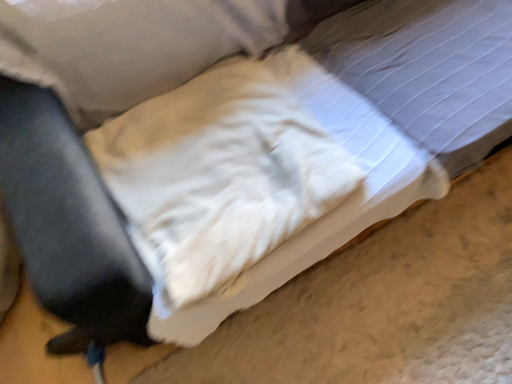
Image resolution: width=512 pixels, height=384 pixels. What do you see at coordinates (219, 175) in the screenshot?
I see `white fluffy pillow at center` at bounding box center [219, 175].

The width and height of the screenshot is (512, 384). Find the location of `white fluffy pillow at center`. white fluffy pillow at center is located at coordinates (219, 175).

This screenshot has height=384, width=512. I want to click on white fluffy pillow at center, so click(219, 175).